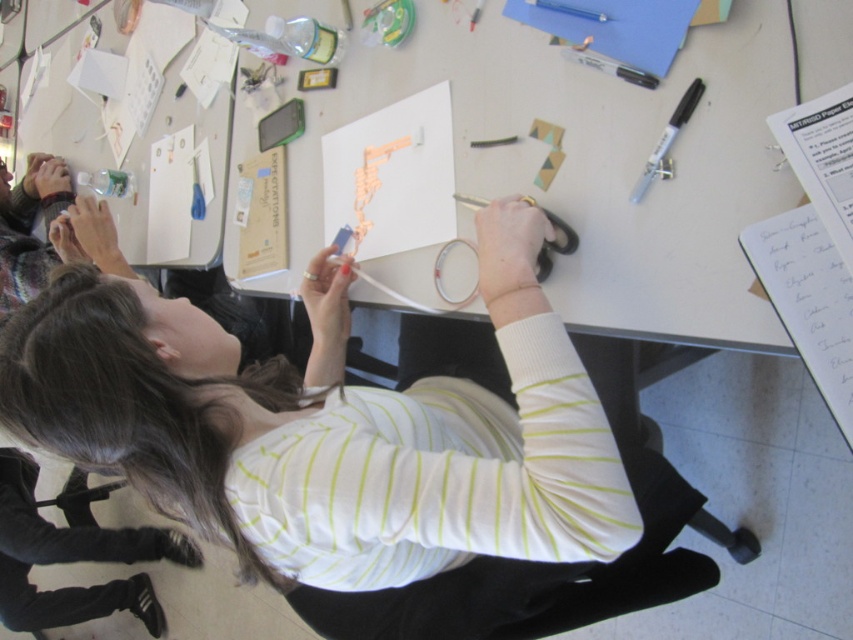
Does white striped shirt at center appear on the left side of black plastic marker at upper right?

Yes, white striped shirt at center is to the left of black plastic marker at upper right.

Who is higher up, white striped shirt at center or black plastic marker at upper right?

black plastic marker at upper right is above.

Find the location of `white striped shirt at center`. white striped shirt at center is located at coordinates (341, 445).

Where is `white striped shirt at center`? white striped shirt at center is located at coordinates pos(341,445).

Is white paper at center thinner than orange foam letters at center?

No.

Does white paper at center appear under orange foam letters at center?

Incorrect, white paper at center is not positioned below orange foam letters at center.

Find the location of `white paper at center`. white paper at center is located at coordinates (589, 164).

Does white striped shirt at center appear on the left side of white paper at center?

Indeed, white striped shirt at center is positioned on the left side of white paper at center.

Is point (537, 284) positioned behind point (492, 19)?

No, it is in front of (492, 19).

This screenshot has height=640, width=853. In order to click on white striped shirt at center in this screenshot , I will do `click(341, 445)`.